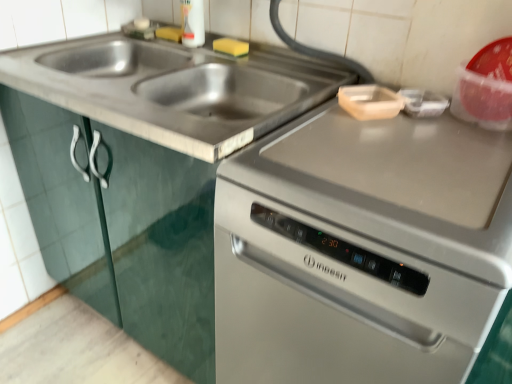
The width and height of the screenshot is (512, 384). What do you see at coordinates (389, 102) in the screenshot?
I see `wooden cutting board at upper right` at bounding box center [389, 102].

You are a GUI agent. You are given a task and a screenshot of the screen. Output one action in this format:
    pyautogui.click(x=<x>, y=<y>)
    Task: Click on the wooden cutting board at upper right
    This screenshot has height=384, width=512.
    Given the screenshot: What is the action you would take?
    pyautogui.click(x=389, y=102)

Where is `yellow sponge at upper center`? yellow sponge at upper center is located at coordinates (231, 47).

Describe the element at coordinates (361, 250) in the screenshot. I see `satin silver oven at right` at that location.

Find the location of `stainless steel sink at upper left`. stainless steel sink at upper left is located at coordinates (175, 88).

Identify the location of wooden cutting board at upper right. click(389, 102).

Visually, is satin silver oven at right positioned to the left or to the right of wooden cutting board at upper right?

Based on their positions, satin silver oven at right is located to the right of wooden cutting board at upper right.

The image size is (512, 384). I want to click on appliance that is on the left side of satin silver oven at right, so click(x=389, y=102).

From the image's perspective, which one is positioned lower, yellow sponge at upper center or wooden cutting board at upper right?

wooden cutting board at upper right.

Between yellow sponge at upper center and wooden cutting board at upper right, which one has more height?

yellow sponge at upper center is taller.

Between point (312, 346) and point (200, 281), which one is positioned in front?

Point (312, 346)

From the image's perspective, which is above, satin silver oven at right or stainless steel dishwasher at center?

stainless steel dishwasher at center, from the image's perspective.

Is satin silver oven at right far from stainless steel dishwasher at center?

No, there isn't a large distance between satin silver oven at right and stainless steel dishwasher at center.

Between satin silver oven at right and stainless steel dishwasher at center, which one appears on the right side from the viewer's perspective?

satin silver oven at right.

In the scene shown: Considering the relative sizes of stainless steel dishwasher at center and yellow sponge at upper center in the image provided, is stainless steel dishwasher at center thinner than yellow sponge at upper center?

No, stainless steel dishwasher at center is not thinner than yellow sponge at upper center.

Who is taller, stainless steel dishwasher at center or yellow sponge at upper center?

stainless steel dishwasher at center.

From a real-world perspective, who is located higher, stainless steel dishwasher at center or yellow sponge at upper center?

yellow sponge at upper center is physically above.

Between stainless steel dishwasher at center and yellow sponge at upper center, which one has larger size?

stainless steel dishwasher at center.

Find the location of a particular element. The height and width of the screenshot is (384, 512). food behind the wooden cutting board at upper right is located at coordinates (231, 47).

Considering the sizes of wooden cutting board at upper right and yellow sponge at upper center in the image, is wooden cutting board at upper right bigger or smaller than yellow sponge at upper center?

In the image, wooden cutting board at upper right appears to be larger than yellow sponge at upper center.

Could you tell me if wooden cutting board at upper right is facing yellow sponge at upper center?

No, wooden cutting board at upper right is not oriented towards yellow sponge at upper center.

Is stainless steel dishwasher at center looking in the opposite direction of stainless steel sink at upper left?

No, stainless steel dishwasher at center is not facing the opposite direction of stainless steel sink at upper left.

Considering the positions of point (177, 292) and point (156, 124), is point (177, 292) closer or farther from the camera than point (156, 124)?

Point (177, 292) appears to be farther away from the viewer than point (156, 124).

Which of these two, stainless steel dishwasher at center or stainless steel sink at upper left, is smaller?

Smaller between the two is stainless steel sink at upper left.

Would you say stainless steel dishwasher at center is inside or outside stainless steel sink at upper left?

stainless steel dishwasher at center is outside stainless steel sink at upper left.

Which is behind, point (356, 95) or point (259, 238)?

The point (356, 95) is farther from the camera.

Is wooden cutting board at upper right looking in the opposite direction of satin silver oven at right?

No.

Considering the sizes of wooden cutting board at upper right and satin silver oven at right in the image, is wooden cutting board at upper right bigger or smaller than satin silver oven at right?

In the image, wooden cutting board at upper right appears to be smaller than satin silver oven at right.

Is satin silver oven at right a part of wooden cutting board at upper right?

Actually, satin silver oven at right is outside wooden cutting board at upper right.

You are a GUI agent. You are given a task and a screenshot of the screen. Output one action in this format:
    pyautogui.click(x=<x>, y=<y>)
    Task: Click on the appliance above the satin silver oven at right (from a real-world perspective)
    This screenshot has height=384, width=512.
    Given the screenshot: What is the action you would take?
    pyautogui.click(x=389, y=102)

Find the location of a particular element. The height and width of the screenshot is (384, 512). appliance on the right of yellow sponge at upper center is located at coordinates (389, 102).

Considering their positions, is wooden cutting board at upper right positioned closer to yellow sponge at upper center than stainless steel dishwasher at center?

Based on the image, wooden cutting board at upper right appears to be nearer to yellow sponge at upper center.

Looking at the image, which one is located closer to satin silver oven at right, stainless steel sink at upper left or wooden cutting board at upper right?

wooden cutting board at upper right is positioned closer to the anchor satin silver oven at right.

When comparing their distances from yellow sponge at upper center, does stainless steel dishwasher at center or satin silver oven at right seem closer?

The object closer to yellow sponge at upper center is stainless steel dishwasher at center.

Consider the image. Looking at the image, which one is located further to stainless steel sink at upper left, satin silver oven at right or yellow sponge at upper center?

satin silver oven at right.

Looking at the image, which one is located further to yellow sponge at upper center, satin silver oven at right or wooden cutting board at upper right?

satin silver oven at right.

Which object lies further to the anchor point stainless steel dishwasher at center, wooden cutting board at upper right or satin silver oven at right?

Among the two, wooden cutting board at upper right is located further to stainless steel dishwasher at center.

Looking at the image, which one is located closer to stainless steel sink at upper left, wooden cutting board at upper right or stainless steel dishwasher at center?

stainless steel dishwasher at center lies closer to stainless steel sink at upper left than the other object.

Based on their spatial positions, is stainless steel dishwasher at center or wooden cutting board at upper right further from satin silver oven at right?

Based on the image, stainless steel dishwasher at center appears to be further to satin silver oven at right.

You are a GUI agent. You are given a task and a screenshot of the screen. Output one action in this format:
    pyautogui.click(x=<x>, y=<y>)
    Task: Click on the sink between stainless steel dishwasher at center and satin silver oven at right from left to right
    The width and height of the screenshot is (512, 384).
    Given the screenshot: What is the action you would take?
    pyautogui.click(x=175, y=88)

Locate an element on the screen. This screenshot has width=512, height=384. appliance between stainless steel sink at upper left and satin silver oven at right from top to bottom is located at coordinates (389, 102).

Find the location of a particular element. cabinetry between satin silver oven at right and yellow sponge at upper center from front to back is located at coordinates (124, 231).

You are a GUI agent. You are given a task and a screenshot of the screen. Output one action in this format:
    pyautogui.click(x=<x>, y=<y>)
    Task: Click on the sink between satin silver oven at right and yellow sponge at upper center from front to back
    
    Given the screenshot: What is the action you would take?
    pyautogui.click(x=175, y=88)